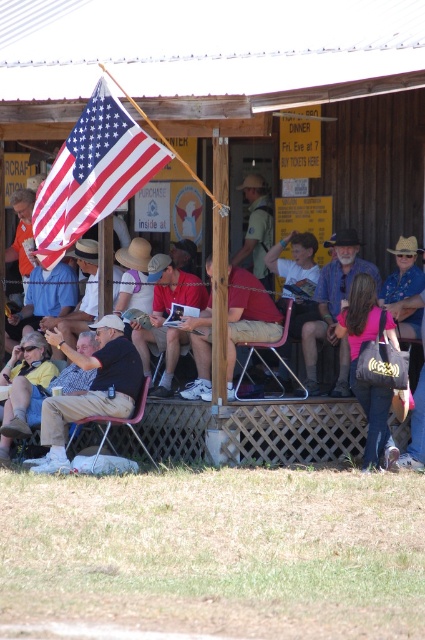
Which of these two, matte black jacket at lower left or brown leather cowboy hat at upper right, stands shorter?

Standing shorter between the two is brown leather cowboy hat at upper right.

Between matte black jacket at lower left and brown leather cowboy hat at upper right, which one appears on the left side from the viewer's perspective?

matte black jacket at lower left

Measure the distance between point (25, 339) and camera.

Point (25, 339) and camera are 14.13 meters apart from each other.

The width and height of the screenshot is (425, 640). Identify the location of matte black jacket at lower left. point(23,387).

Does wooden hut at center have a lesser height compared to khaki cotton shorts at center?

Indeed, wooden hut at center has a lesser height compared to khaki cotton shorts at center.

Can you confirm if wooden hut at center is thinner than khaki cotton shorts at center?

Incorrect, wooden hut at center's width is not less than khaki cotton shorts at center's.

Locate an element on the screen. wooden hut at center is located at coordinates (240, 88).

Where is `wooden hut at center`? wooden hut at center is located at coordinates (240, 88).

Is wooden hut at center wider than brown straw cowboy hat at center?

Yes.

At what (x,y) coordinates should I click in order to perform the action: click on wooden hut at center. Please return your answer as a coordinate pair (x, y). This screenshot has width=425, height=640. Looking at the image, I should click on (240, 88).